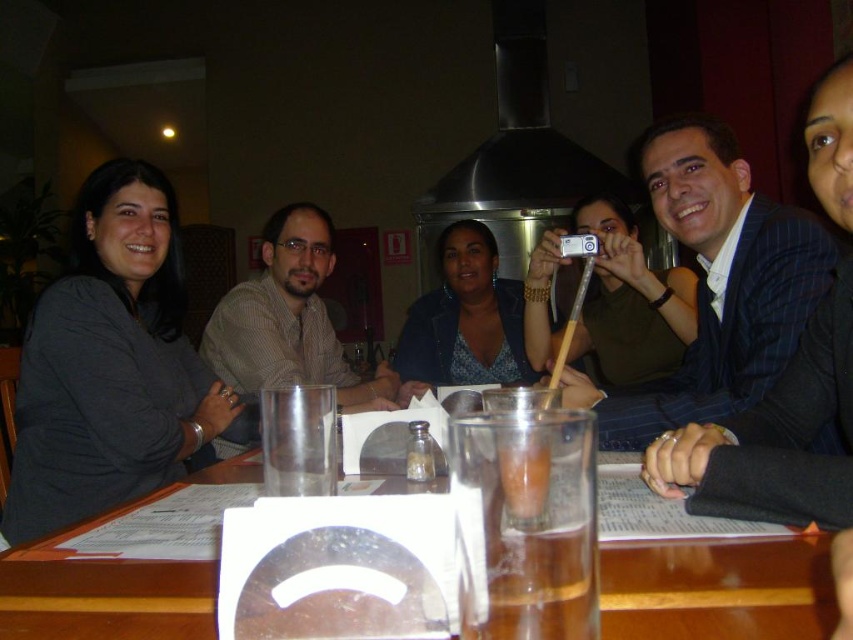
Question: In this image, where is dark blue suit at center located relative to matte brown shirt at center?

Choices:
 (A) left
 (B) right

Answer: (B)

Question: Which point is farther to the camera?

Choices:
 (A) (751, 401)
 (B) (677, 628)

Answer: (A)

Question: Which object is closer to the camera taking this photo?

Choices:
 (A) transparent glass table at center
 (B) matte brown shirt at center
 (C) dark blue suit at center

Answer: (A)

Question: Which of the following is the farthest from the observer?

Choices:
 (A) transparent glass table at center
 (B) dark blue suit at center
 (C) matte brown shirt at center

Answer: (C)

Question: Is transparent glass table at center positioned before matte brown shirt at center?

Choices:
 (A) yes
 (B) no

Answer: (A)

Question: Does transparent glass table at center appear over matte brown shirt at center?

Choices:
 (A) yes
 (B) no

Answer: (B)